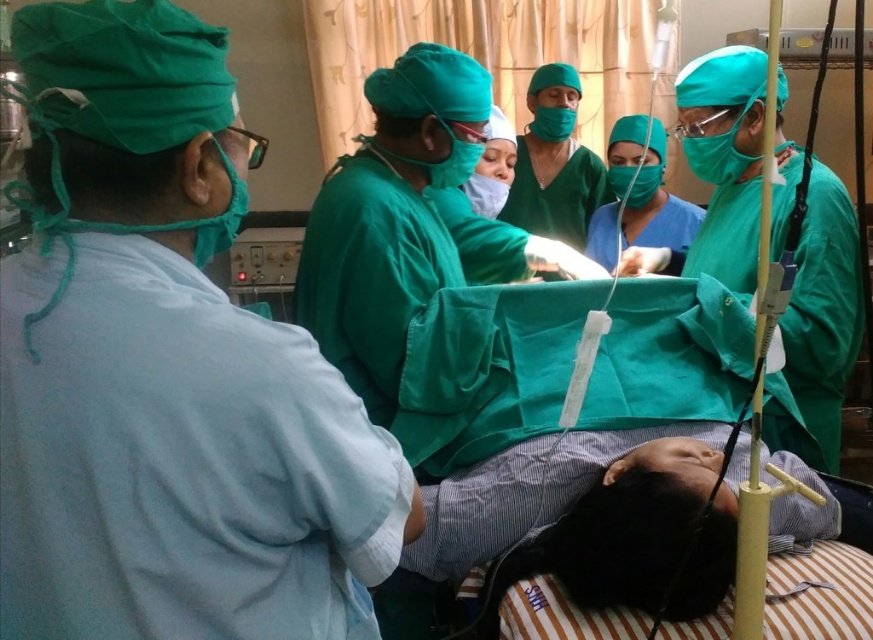
Question: Is matte green gown at left bigger than matte green gown at center?

Choices:
 (A) no
 (B) yes

Answer: (B)

Question: Which of the following is the farthest from the observer?

Choices:
 (A) matte green gown at left
 (B) matte green gown at center

Answer: (B)

Question: Which point is closer to the camera?

Choices:
 (A) matte green gown at center
 (B) matte green gown at left

Answer: (B)

Question: Is matte green gown at left behind matte green gown at center?

Choices:
 (A) no
 (B) yes

Answer: (A)

Question: Does matte green gown at left appear on the right side of matte green gown at center?

Choices:
 (A) yes
 (B) no

Answer: (B)